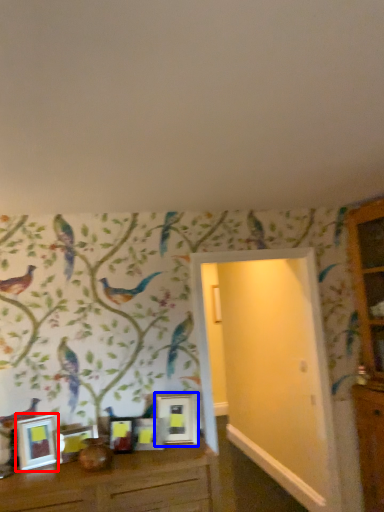
Question: Which of the following is the closest to the observer, picture frame (highlighted by a red box) or picture frame (highlighted by a blue box)?

Choices:
 (A) picture frame
 (B) picture frame

Answer: (A)